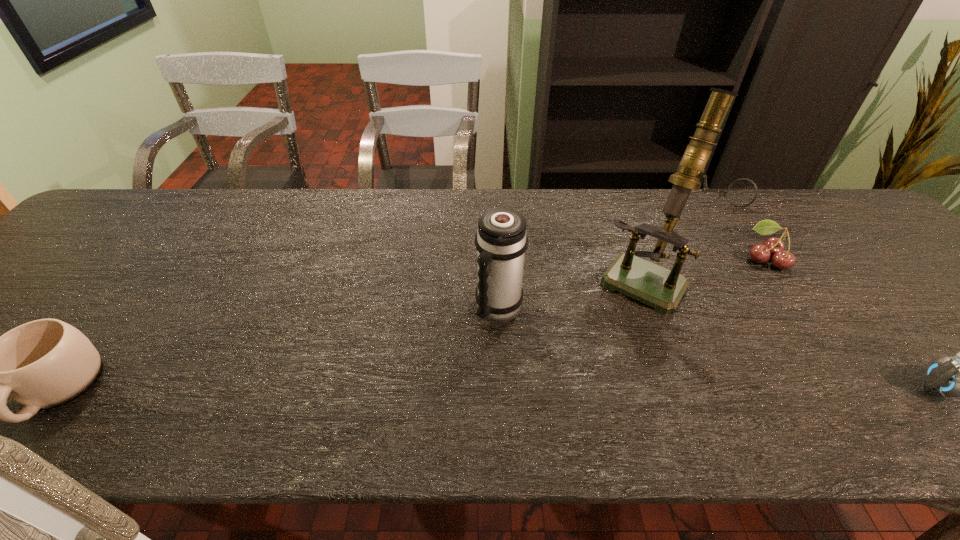
Image resolution: width=960 pixels, height=540 pixels. I want to click on the tallest object, so click(656, 286).

Where is `microscope`? The image size is (960, 540). microscope is located at coordinates (656, 286).

At what (x,y) coordinates should I click in order to perform the action: click on the fourth object from left to right. Please return your answer as a coordinate pair (x, y). This screenshot has width=960, height=540. Looking at the image, I should click on (760, 253).

Where is `thermos bottle`? The width and height of the screenshot is (960, 540). thermos bottle is located at coordinates (501, 241).

Locate an element on the screen. The image size is (960, 540). the fourth object from right to left is located at coordinates (501, 241).

This screenshot has height=540, width=960. Find the location of `vacant area situated at the eyepiece of the tallest object`. vacant area situated at the eyepiece of the tallest object is located at coordinates (596, 356).

The image size is (960, 540). What are the coordinates of `free location located 0.170m at the eyepiece of the tallest object` in the screenshot? It's located at (596, 356).

At what (x,y) coordinates should I click in order to perform the action: click on vacant region located at the eyepiece of the tallest object. Please return your answer as a coordinate pair (x, y). This screenshot has height=540, width=960. Looking at the image, I should click on (586, 372).

This screenshot has height=540, width=960. What are the coordinates of `vacant space located on the leaves of the cherry` in the screenshot? It's located at (703, 298).

Find the location of a particular element. The width and height of the screenshot is (960, 540). free spot located 0.310m on the leaves of the cherry is located at coordinates (672, 316).